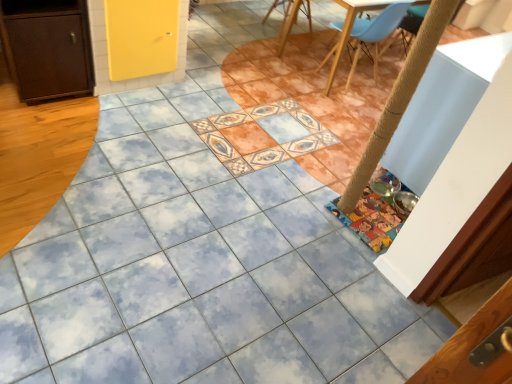
Find the location of a particular element. The width and height of the screenshot is (512, 384). light blue plastic chair at upper right, the second chair positioned from the back is located at coordinates pyautogui.click(x=365, y=26).

Measure the distance between point (x=275, y=1) and camera.

Point (x=275, y=1) and camera are 4.59 meters apart.

Describe the element at coordinates (275, 7) in the screenshot. I see `wooden chair at upper center, which ranks as the 1th chair in left-to-right order` at that location.

Measure the distance between brown matte cabinet at left and camera.

brown matte cabinet at left and camera are 7.57 feet apart from each other.

Find the location of a particular element. light blue plastic chair at upper right, which ranks as the 1th chair in front-to-back order is located at coordinates (365, 26).

Considering the sizes of objects wooden chair at upper center, which ranks as the 1th chair in left-to-right order, and light blue plastic chair at upper right, the second chair positioned from the back, in the image provided, who is shorter, wooden chair at upper center, which ranks as the 1th chair in left-to-right order, or light blue plastic chair at upper right, the second chair positioned from the back,?

wooden chair at upper center, which ranks as the 1th chair in left-to-right order, is shorter.

Does wooden chair at upper center, which is the first chair from back to front, have a lesser width compared to light blue plastic chair at upper right, the second chair positioned from the back?

No, wooden chair at upper center, which is the first chair from back to front, is not thinner than light blue plastic chair at upper right, the second chair positioned from the back.

Does point (264, 22) come farther from viewer compared to point (378, 31)?

That is True.

Is wooden chair at upper center, the 2th chair positioned from the front, far from light blue plastic chair at upper right, which is the first chair from right to left?

No, there isn't a large distance between wooden chair at upper center, the 2th chair positioned from the front, and light blue plastic chair at upper right, which is the first chair from right to left.

From a real-world perspective, between brown matte cabinet at left and wooden chair at upper center, which appears as the second chair when viewed from the right, who is vertically higher?

From a 3D spatial view, brown matte cabinet at left is above.

Is brown matte cabinet at left bigger than wooden chair at upper center, which ranks as the 1th chair in left-to-right order?

Yes.

From the image's perspective, between brown matte cabinet at left and wooden chair at upper center, which is the first chair from back to front, which one is located above?

wooden chair at upper center, which is the first chair from back to front, is shown above in the image.

Does brown matte cabinet at left have a greater width compared to wooden chair at upper center, which is the first chair from back to front?

Incorrect, the width of brown matte cabinet at left does not surpass that of wooden chair at upper center, which is the first chair from back to front.

Is light blue plastic chair at upper right, which ranks as the 1th chair in front-to-back order, not inside brown matte cabinet at left?

light blue plastic chair at upper right, which ranks as the 1th chair in front-to-back order, lies outside brown matte cabinet at left's area.

Which object is positioned more to the left, light blue plastic chair at upper right, the second chair positioned from the back, or brown matte cabinet at left?

brown matte cabinet at left is more to the left.

Is light blue plastic chair at upper right, which is the first chair from right to left, not close to brown matte cabinet at left?

Yes, light blue plastic chair at upper right, which is the first chair from right to left, and brown matte cabinet at left are quite far apart.

Identify the location of cabinetry lying in front of the light blue plastic chair at upper right, which ranks as the 1th chair in front-to-back order. (47, 48).

Considering the sizes of objects brown matte cabinet at left and light blue plastic chair at upper right, the second chair positioned from the back, in the image provided, who is smaller, brown matte cabinet at left or light blue plastic chair at upper right, the second chair positioned from the back,?

brown matte cabinet at left is smaller.

Is brown matte cabinet at left looking in the opposite direction of light blue plastic chair at upper right, which is the first chair from right to left?

No, light blue plastic chair at upper right, which is the first chair from right to left, is not at the back of brown matte cabinet at left.

From the image's perspective, would you say brown matte cabinet at left is shown under light blue plastic chair at upper right, the second chair in the left-to-right sequence?

Correct, brown matte cabinet at left appears lower than light blue plastic chair at upper right, the second chair in the left-to-right sequence, in the image.

Is light blue plastic chair at upper right, which ranks as the 1th chair in front-to-back order, oriented towards wooden chair at upper center, the 2th chair positioned from the front?

Yes, light blue plastic chair at upper right, which ranks as the 1th chair in front-to-back order, is turned towards wooden chair at upper center, the 2th chair positioned from the front.

Is light blue plastic chair at upper right, which is the first chair from right to left, behind wooden chair at upper center, the 2th chair positioned from the front?

That is False.

Which of these two, light blue plastic chair at upper right, which is the first chair from right to left, or wooden chair at upper center, which ranks as the 1th chair in left-to-right order, stands shorter?

With less height is wooden chair at upper center, which ranks as the 1th chair in left-to-right order.

Is wooden chair at upper center, which is the first chair from back to front, inside the boundaries of brown matte cabinet at left, or outside?

wooden chair at upper center, which is the first chair from back to front, lies outside brown matte cabinet at left.

Is wooden chair at upper center, which ranks as the 1th chair in left-to-right order, positioned before brown matte cabinet at left?

A: No, wooden chair at upper center, which ranks as the 1th chair in left-to-right order, is behind brown matte cabinet at left.

Looking at this image, how different are the orientations of wooden chair at upper center, the 2th chair positioned from the front, and brown matte cabinet at left in degrees?

9.03 degrees.

Which of these two, wooden chair at upper center, which ranks as the 1th chair in left-to-right order, or brown matte cabinet at left, is thinner?

Thinner between the two is brown matte cabinet at left.

Image resolution: width=512 pixels, height=384 pixels. In order to click on chair located behind the light blue plastic chair at upper right, which is the first chair from right to left in this screenshot , I will do `click(275, 7)`.

This screenshot has width=512, height=384. Find the location of `chair that is under the brown matte cabinet at left (from a real-world perspective)`. chair that is under the brown matte cabinet at left (from a real-world perspective) is located at coordinates (275, 7).

When comparing their distances from light blue plastic chair at upper right, the second chair in the left-to-right sequence, does brown matte cabinet at left or wooden chair at upper center, which appears as the second chair when viewed from the right, seem closer?

wooden chair at upper center, which appears as the second chair when viewed from the right, is closer to light blue plastic chair at upper right, the second chair in the left-to-right sequence.

Estimate the real-world distances between objects in this image. Which object is closer to wooden chair at upper center, which is the first chair from back to front, light blue plastic chair at upper right, which ranks as the 1th chair in front-to-back order, or brown matte cabinet at left?

light blue plastic chair at upper right, which ranks as the 1th chair in front-to-back order.

Based on their spatial positions, is brown matte cabinet at left or light blue plastic chair at upper right, the second chair in the left-to-right sequence, closer to wooden chair at upper center, which is the first chair from back to front?

light blue plastic chair at upper right, the second chair in the left-to-right sequence, lies closer to wooden chair at upper center, which is the first chair from back to front, than the other object.

From the image, which object appears to be farther from brown matte cabinet at left, light blue plastic chair at upper right, the second chair positioned from the back, or wooden chair at upper center, which appears as the second chair when viewed from the right?

wooden chair at upper center, which appears as the second chair when viewed from the right, is further to brown matte cabinet at left.

Which object lies further to the anchor point light blue plastic chair at upper right, which is the first chair from right to left, wooden chair at upper center, which is the first chair from back to front, or brown matte cabinet at left?

Among the two, brown matte cabinet at left is located further to light blue plastic chair at upper right, which is the first chair from right to left.

Looking at the image, which one is located closer to brown matte cabinet at left, wooden chair at upper center, the 2th chair positioned from the front, or light blue plastic chair at upper right, the second chair in the left-to-right sequence?

light blue plastic chair at upper right, the second chair in the left-to-right sequence, lies closer to brown matte cabinet at left than the other object.

Locate an element on the screen. chair between brown matte cabinet at left and light blue plastic chair at upper right, which ranks as the 1th chair in front-to-back order, in the horizontal direction is located at coordinates (275, 7).